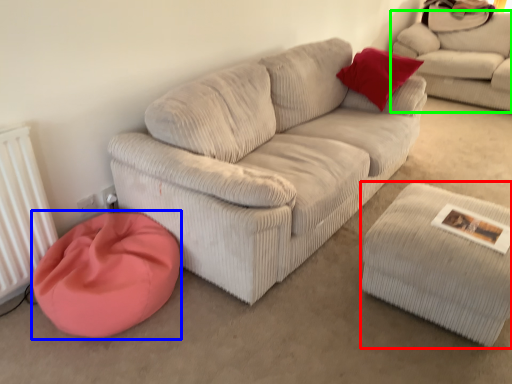
Question: Which object is positioned closest to stool (highlighted by a red box)? Select from cat bed (highlighted by a blue box) and studio couch (highlighted by a green box).

Choices:
 (A) cat bed
 (B) studio couch

Answer: (A)